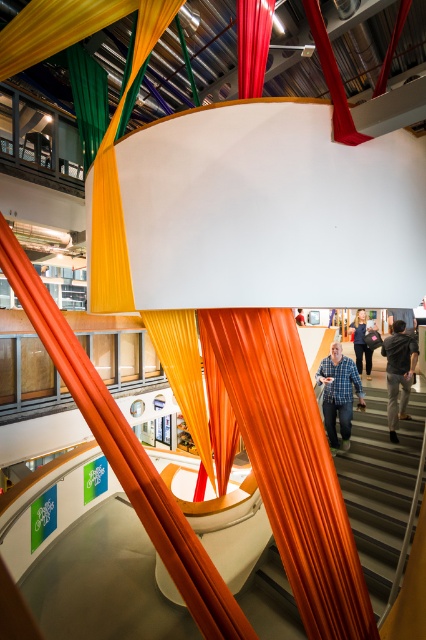
You are standing in the modern indoor space with the central cylindrical structure. You want to take a photo of the vibrant fabric strips hanging around the cylinder. There is a point at coordinates point (242,36) that you need to focus on. If your camera can focus on objects within 8 feet, will you be able to capture this point clearly?

The distance of point (242,36) from the camera is 7.99 feet, which is within the camera focus range of 8 feet. Therefore, you can capture the point clearly.

You are an interior designer assessing the space. You notice the orange fabric curtain at center and the blue plaid shirt at center. Which object is covering the other?

The orange fabric curtain at center is positioned over the blue plaid shirt at center, so it is covering the shirt.

You are an interior designer planning to place a 3.5 feet wide decorative sculpture between the orange fabric curtain at center and the blue plaid shirt at center. Can the sculpture fit between them without overlapping either object?

The orange fabric curtain at center and blue plaid shirt at center are 8.41 feet apart. Since the sculpture is 3.5 feet wide, there is enough space between them to place it without overlapping either object.